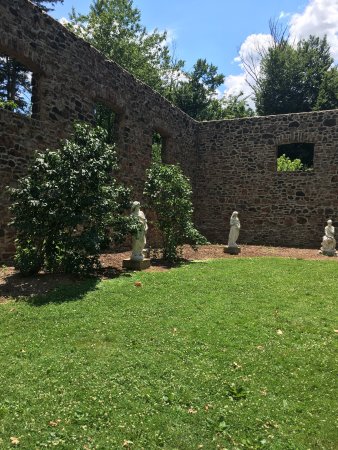
Where is `statue`? statue is located at coordinates (136, 246).